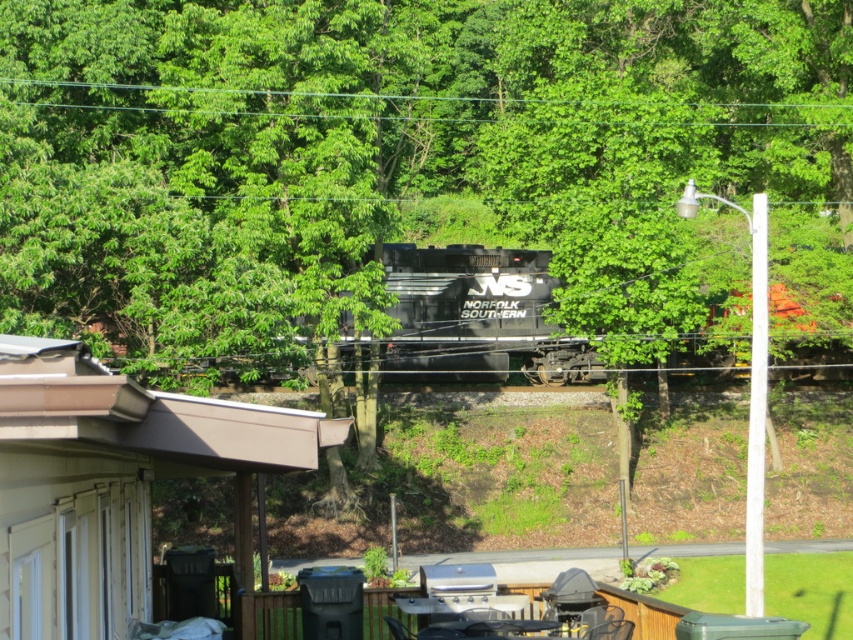
Question: Can you confirm if brown wood shed at lower left is positioned to the right of black matte train at center?

Choices:
 (A) no
 (B) yes

Answer: (A)

Question: Is brown wood shed at lower left above black matte train at center?

Choices:
 (A) yes
 (B) no

Answer: (B)

Question: Which point is closer to the camera?

Choices:
 (A) (173, 429)
 (B) (386, 380)

Answer: (A)

Question: Which point is closer to the camera?

Choices:
 (A) (236, 468)
 (B) (403, 284)

Answer: (A)

Question: Among these points, which one is nearest to the camera?

Choices:
 (A) (486, 285)
 (B) (56, 532)

Answer: (B)

Question: Does brown wood shed at lower left have a lesser width compared to black matte train at center?

Choices:
 (A) no
 (B) yes

Answer: (B)